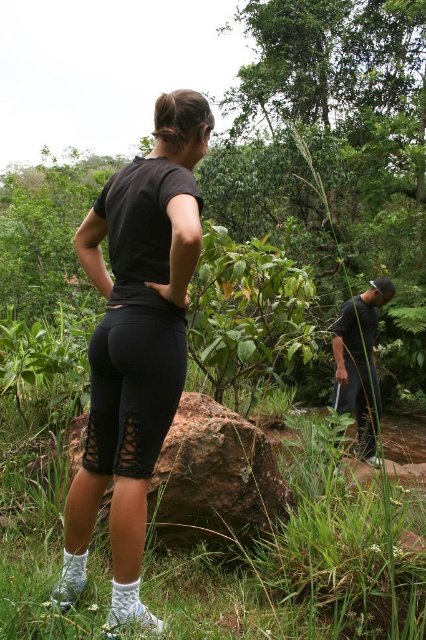
Is point (149, 468) positioned behind point (362, 422)?

No, (149, 468) is in front of (362, 422).

Can you confirm if black mesh leggings at center is shorter than black mesh shorts at lower right?

Correct, black mesh leggings at center is not as tall as black mesh shorts at lower right.

Between point (140, 390) and point (340, 387), which one is positioned in front?

Point (140, 390)

This screenshot has width=426, height=640. In order to click on black mesh leggings at center in this screenshot , I will do pos(134,387).

Which of these two, dark gray fabric shirt at center or black mesh shorts at lower right, stands shorter?

With less height is black mesh shorts at lower right.

Based on the photo, is dark gray fabric shirt at center smaller than black mesh shorts at lower right?

Actually, dark gray fabric shirt at center might be larger than black mesh shorts at lower right.

Is point (345, 317) closer to viewer compared to point (379, 410)?

Yes, it is in front of point (379, 410).

Identify the location of dark gray fabric shirt at center. Image resolution: width=426 pixels, height=640 pixels. (359, 362).

What do you see at coordinates (135, 340) in the screenshot?
I see `black matte leggings at center` at bounding box center [135, 340].

Is the position of black matte leggings at center less distant than that of black mesh leggings at center?

Yes.

Image resolution: width=426 pixels, height=640 pixels. What do you see at coordinates (135, 340) in the screenshot?
I see `black matte leggings at center` at bounding box center [135, 340].

Where is `black matte leggings at center`? black matte leggings at center is located at coordinates (135, 340).